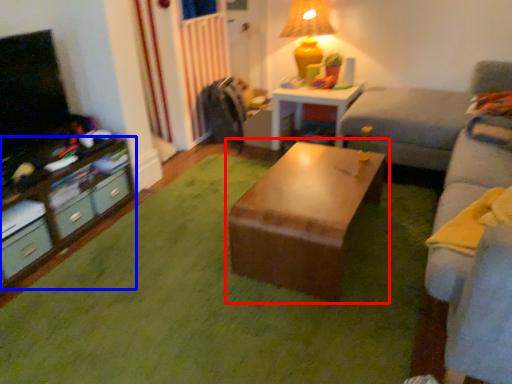
Question: Which point is closer to the camera, table (highlighted by a red box) or desk (highlighted by a blue box)?

Choices:
 (A) table
 (B) desk

Answer: (A)